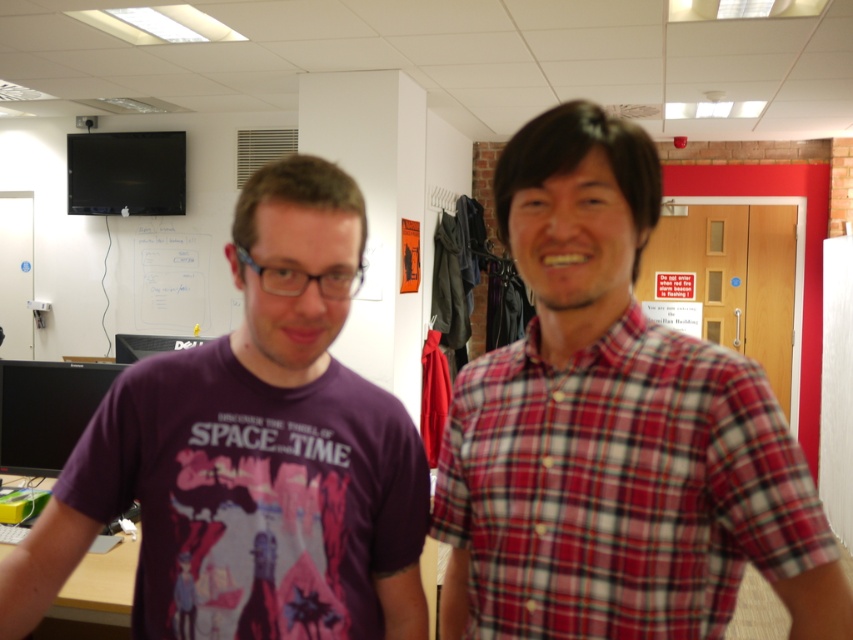
You are standing in the office and want to move from point A to point B. Point A is at coordinates point (26, 550) and point B is at coordinates point (660, 472). Which point is closer to you?

Point (26, 550) is closer to you because it is further to the viewer than point (660, 472).